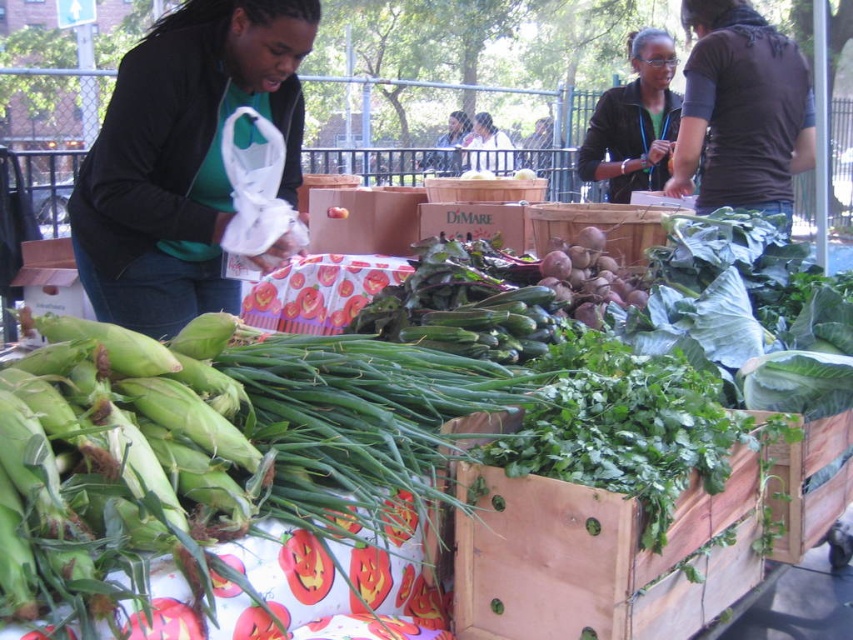
Who is positioned more to the right, green matte corn at left or green matte jacket at upper left?

green matte corn at left

Who is taller, green matte corn at left or green matte jacket at upper left?

green matte jacket at upper left

Who is more forward, (x=219, y=381) or (x=164, y=250)?

Point (x=219, y=381)

The image size is (853, 640). What are the coordinates of `green matte corn at left` in the screenshot? It's located at click(119, 464).

Is point (636, 77) more distant than point (450, 170)?

Yes, point (636, 77) is behind point (450, 170).

Does matte black jacket at upper right appear on the right side of green fabric shirt at upper center?

Indeed, matte black jacket at upper right is positioned on the right side of green fabric shirt at upper center.

Find the location of a particular element. matte black jacket at upper right is located at coordinates (634, 122).

Does green matte jacket at upper left appear under dark brown shirt at upper right?

Yes, green matte jacket at upper left is below dark brown shirt at upper right.

What do you see at coordinates (183, 157) in the screenshot? I see `green matte jacket at upper left` at bounding box center [183, 157].

Locate an element on the screen. This screenshot has height=640, width=853. green matte jacket at upper left is located at coordinates (183, 157).